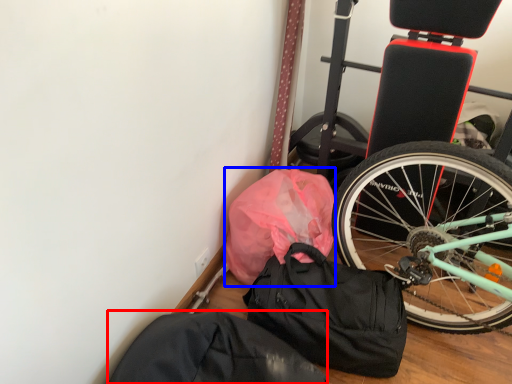
Question: Which of the following is the farthest to the observer, sack (highlighted by a red box) or material (highlighted by a blue box)?

Choices:
 (A) sack
 (B) material

Answer: (B)